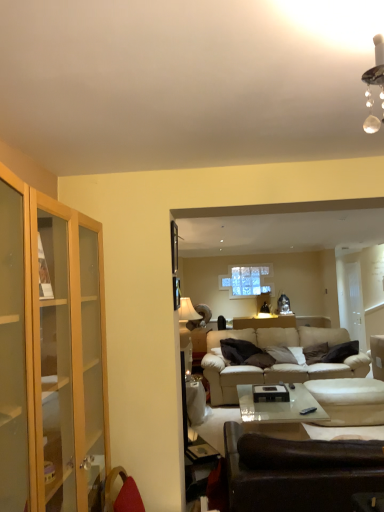
Question: From a real-world perspective, is dark gray fabric pillow at center positioned above or below beige leather couch at center, the first studio couch when ordered from back to front?

Choices:
 (A) below
 (B) above

Answer: (B)

Question: In terms of height, does dark gray fabric pillow at center look taller or shorter compared to beige leather couch at center, the first studio couch when ordered from back to front?

Choices:
 (A) tall
 (B) short

Answer: (B)

Question: Estimate the real-world distances between objects in this image. Which object is closer to the beige leather couch at center, the first studio couch when ordered from back to front?

Choices:
 (A) dark gray fabric pillow at center
 (B) beige fabric armchair at right
 (C) beige fabric swivel chair at lower right
 (D) leather couch at lower right, which ranks as the 1th studio couch in front-to-back order

Answer: (C)

Question: Based on their relative distances, which object is nearer to the leather couch at lower right, which ranks as the 1th studio couch in front-to-back order?

Choices:
 (A) dark gray fabric pillow at center
 (B) beige fabric swivel chair at lower right
 (C) beige leather couch at center, the first studio couch when ordered from back to front
 (D) beige fabric armchair at right

Answer: (B)